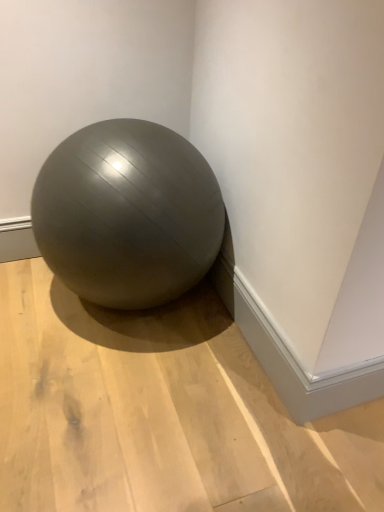
Question: From the image's perspective, is satin gray ball at center positioned above or below matte gray ball at center?

Choices:
 (A) above
 (B) below

Answer: (A)

Question: Is satin gray ball at center wider or thinner than matte gray ball at center?

Choices:
 (A) wide
 (B) thin

Answer: (B)

Question: Considering the positions of point [x=89, y=181] and point [x=175, y=401], is point [x=89, y=181] closer or farther from the camera than point [x=175, y=401]?

Choices:
 (A) farther
 (B) closer

Answer: (B)

Question: Is point (91, 441) positioned closer to the camera than point (172, 258)?

Choices:
 (A) farther
 (B) closer

Answer: (B)

Question: From their relative heights in the image, would you say matte gray ball at center is taller or shorter than satin gray ball at center?

Choices:
 (A) tall
 (B) short

Answer: (B)

Question: In the image, is matte gray ball at center positioned in front of or behind satin gray ball at center?

Choices:
 (A) behind
 (B) front

Answer: (B)

Question: Is matte gray ball at center wider or thinner than satin gray ball at center?

Choices:
 (A) wide
 (B) thin

Answer: (A)